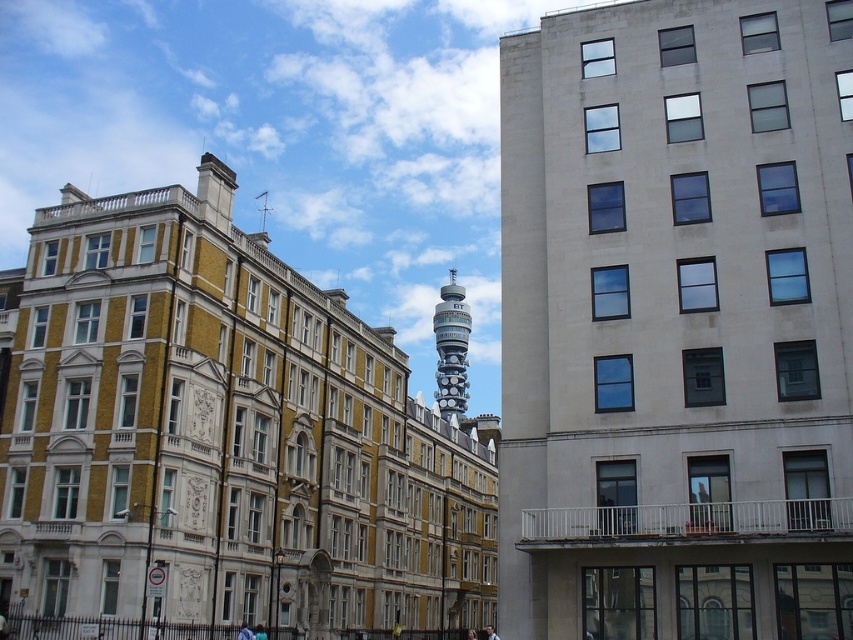
Can you confirm if smooth concrete tower at center is taller than silver metallic bt tower at center?

Yes, smooth concrete tower at center is taller than silver metallic bt tower at center.

Can you confirm if smooth concrete tower at center is shorter than silver metallic bt tower at center?

No, smooth concrete tower at center is not shorter than silver metallic bt tower at center.

Does point (770, 598) come behind point (447, 403)?

No, (770, 598) is in front of (447, 403).

Image resolution: width=853 pixels, height=640 pixels. In order to click on smooth concrete tower at center in this screenshot , I will do `click(677, 321)`.

Can you confirm if silver metallic bt tower at center is positioned above light brown hair at center?

Correct, silver metallic bt tower at center is located above light brown hair at center.

Who is more forward, (x=454, y=275) or (x=494, y=628)?

Point (x=494, y=628) is in front.

Does point (460, 400) lie behind point (492, 636)?

Yes, it is.

Locate an element on the screen. The width and height of the screenshot is (853, 640). silver metallic bt tower at center is located at coordinates (451, 349).

You are a GUI agent. You are given a task and a screenshot of the screen. Output one action in this format:
    pyautogui.click(x=<x>, y=<y>)
    Task: Click on the smooth concrete tower at center
    
    Given the screenshot: What is the action you would take?
    pyautogui.click(x=677, y=321)

Does smooth concrete tower at center have a greater height compared to light brown hair at center?

Yes.

Is point (799, 381) behind point (486, 636)?

No.

You are a GUI agent. You are given a task and a screenshot of the screen. Output one action in this format:
    pyautogui.click(x=<x>, y=<y>)
    Task: Click on the smooth concrete tower at center
    
    Given the screenshot: What is the action you would take?
    pyautogui.click(x=677, y=321)